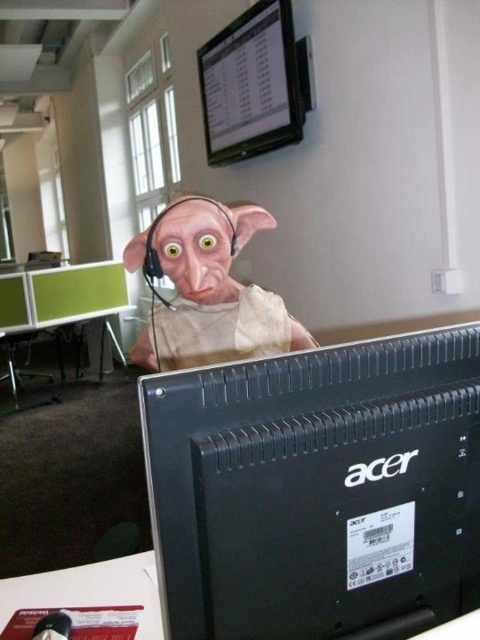
You are setting up a video call and need to position your camera so that your face is centered in the frame. Given the distance between the white plastic computer desk at lower left and the camera, is the camera positioned far enough to capture your entire upper body comfortably?

The white plastic computer desk at lower left and camera are 35.66 inches apart from each other. At this distance, the camera should be able to capture your entire upper body comfortably during the video call.

You are organizing an office space and need to place the matte plastic monitor at upper center and the white plastic computer desk at lower left. Given their sizes, which object should be placed in a larger area to accommodate its dimensions?

The matte plastic monitor at upper center has a larger size compared to the white plastic computer desk at lower left, so it should be placed in a larger area to accommodate its dimensions.

You are an office worker who needs to move a 8 feet long cable from the matte plastic monitor at upper center to the white plastic computer desk at lower left. Will the cable be long enough to reach?

The matte plastic monitor at upper center is 7.99 feet from the white plastic computer desk at lower left. The cable is 8 feet long, so it should just barely reach, but there might be a slight shortage due to the cable needing some slack for installation.